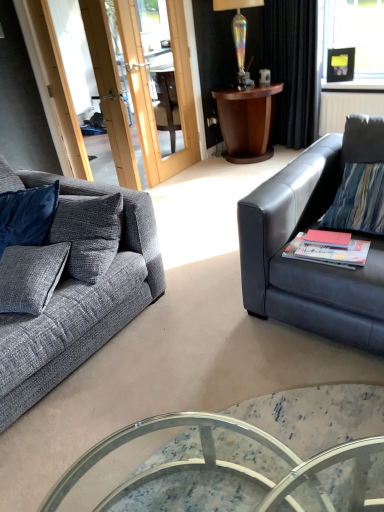
What do you see at coordinates (304, 230) in the screenshot? This screenshot has height=512, width=384. I see `matte black couch at right, positioned as the second studio couch in left-to-right order` at bounding box center [304, 230].

Where is `iridescent glass lamp at upper center`? The width and height of the screenshot is (384, 512). iridescent glass lamp at upper center is located at coordinates (239, 35).

At what (x,y) coordinates should I click in order to perform the action: click on marble glass coffee table at center. Please return your answer as a coordinate pair (x, y). Image resolution: width=384 pixels, height=512 pixels. Looking at the image, I should click on (238, 459).

What is the approximate width of black velvet curtain at upper right?

black velvet curtain at upper right is 26.96 centimeters wide.

What is the approximate height of dark wood side table at upper center?

dark wood side table at upper center is 26.50 inches in height.

Image resolution: width=384 pixels, height=512 pixels. Describe the element at coordinates (247, 121) in the screenshot. I see `dark wood side table at upper center` at that location.

Locate an element on the screen. The width and height of the screenshot is (384, 512). textured gray couch at left, which is counted as the 1th studio couch, starting from the left is located at coordinates (79, 290).

Would you consider marble glass coffee table at center to be distant from iridescent glass lamp at upper center?

Yes.

Is marble glass coffee table at center in front of or behind iridescent glass lamp at upper center in the image?

Clearly, marble glass coffee table at center is in front of iridescent glass lamp at upper center.

What's the angular difference between marble glass coffee table at center and iridescent glass lamp at upper center's facing directions?

There is a 2.73-degree angle between the facing directions of marble glass coffee table at center and iridescent glass lamp at upper center.

Which is in front, point (35, 391) or point (305, 238)?

The point (35, 391) is closer.

In terms of width, does textured gray couch at left, which is counted as the 1th studio couch, starting from the left, look wider or thinner when compared to matte red book at right, which ranks as the 1th book in left-to-right order?

textured gray couch at left, which is counted as the 1th studio couch, starting from the left, is wider than matte red book at right, which ranks as the 1th book in left-to-right order.

How different are the orientations of textured gray couch at left, which is counted as the 1th studio couch, starting from the left, and matte red book at right, acting as the second book starting from the right, in degrees?

textured gray couch at left, which is counted as the 1th studio couch, starting from the left, and matte red book at right, acting as the second book starting from the right, are facing 79.4 degrees away from each other.

From the image's perspective, which book is the 1st one above the textured gray couch at left, which is counted as the 1th studio couch, starting from the left? Please provide its 2D coordinates.

[(328, 252)]

Which is more to the right, matte white coffee cup at upper center or textured gray couch at left, which is counted as the 1th studio couch, starting from the left?

matte white coffee cup at upper center.

Which point is more forward, (261, 80) or (39, 326)?

The point (39, 326) is more forward.

From the image's perspective, which is above, matte white coffee cup at upper center or textured gray couch at left, placed as the 2th studio couch when sorted from right to left?

matte white coffee cup at upper center is shown above in the image.

Looking at this image, is matte white coffee cup at upper center positioned with its back to textured gray couch at left, which is counted as the 1th studio couch, starting from the left?

matte white coffee cup at upper center is not turned away from textured gray couch at left, which is counted as the 1th studio couch, starting from the left.

From the picture: From the image's perspective, is matte red book at right, acting as the second book starting from the right, located above matte black couch at right, positioned as the second studio couch in left-to-right order?

Actually, matte red book at right, acting as the second book starting from the right, appears below matte black couch at right, positioned as the second studio couch in left-to-right order, in the image.

Considering the relative sizes of matte red book at right, acting as the second book starting from the right, and matte black couch at right, positioned as the second studio couch in left-to-right order, in the image provided, is matte red book at right, acting as the second book starting from the right, taller than matte black couch at right, positioned as the second studio couch in left-to-right order,?

Incorrect, the height of matte red book at right, acting as the second book starting from the right, is not larger of that of matte black couch at right, positioned as the second studio couch in left-to-right order.

Is matte red book at right, which ranks as the 1th book in left-to-right order, wider than matte black couch at right, positioned as the 1th studio couch in right-to-left order?

Incorrect, the width of matte red book at right, which ranks as the 1th book in left-to-right order, does not surpass that of matte black couch at right, positioned as the 1th studio couch in right-to-left order.

Consider the image. Considering their positions, is matte red book at right, acting as the second book starting from the right, located in front of or behind matte black couch at right, positioned as the 1th studio couch in right-to-left order?

matte red book at right, acting as the second book starting from the right, is positioned farther from the viewer than matte black couch at right, positioned as the 1th studio couch in right-to-left order.

From a real-world perspective, which is physically above, iridescent glass lamp at upper center or black velvet curtain at upper right?

iridescent glass lamp at upper center is physically above.

Does iridescent glass lamp at upper center come in front of black velvet curtain at upper right?

Yes, iridescent glass lamp at upper center is closer to the camera.

How different are the orientations of iridescent glass lamp at upper center and black velvet curtain at upper right in degrees?

89.1 degrees separate the facing orientations of iridescent glass lamp at upper center and black velvet curtain at upper right.

Between iridescent glass lamp at upper center and black velvet curtain at upper right, which one has more height?

black velvet curtain at upper right.

Is matte black couch at right, positioned as the 1th studio couch in right-to-left order, aimed at marble glass coffee table at center?

Yes, matte black couch at right, positioned as the 1th studio couch in right-to-left order, faces towards marble glass coffee table at center.

Which of these two, matte black couch at right, positioned as the second studio couch in left-to-right order, or marble glass coffee table at center, is wider?

With larger width is matte black couch at right, positioned as the second studio couch in left-to-right order.

From a real-world perspective, who is located higher, matte black couch at right, positioned as the 1th studio couch in right-to-left order, or marble glass coffee table at center?

From a 3D spatial view, matte black couch at right, positioned as the 1th studio couch in right-to-left order, is above.

Choose the correct answer: Is dark wood side table at upper center inside matte red book at right, the first book in the right-to-left sequence, or outside it?

dark wood side table at upper center exists outside the volume of matte red book at right, the first book in the right-to-left sequence.

Which is more to the left, dark wood side table at upper center or matte red book at right, the first book in the right-to-left sequence?

dark wood side table at upper center is more to the left.

From the image's perspective, which one is positioned higher, dark wood side table at upper center or matte red book at right, the second book when ordered from left to right?

dark wood side table at upper center.

What are the coordinates of `lamp lying above the marble glass coffee table at center (from the image's perspective)` in the screenshot? It's located at [x=239, y=35].

In order to click on studio couch that is the 2nd one when counting forward from the matte red book at right, which ranks as the 1th book in left-to-right order in this screenshot , I will do `click(79, 290)`.

Which object lies nearer to the anchor point dark wood side table at upper center, textured gray couch at left, which is counted as the 1th studio couch, starting from the left, or matte black couch at right, positioned as the second studio couch in left-to-right order?

matte black couch at right, positioned as the second studio couch in left-to-right order.

Based on their spatial positions, is textured gray couch at left, placed as the 2th studio couch when sorted from right to left, or black velvet curtain at upper right further from matte red book at right, acting as the second book starting from the right?

The object further to matte red book at right, acting as the second book starting from the right, is black velvet curtain at upper right.

In the scene shown: From the image, which object appears to be farther from dark wood side table at upper center, matte red book at right, the first book in the right-to-left sequence, or matte black couch at right, positioned as the second studio couch in left-to-right order?

matte red book at right, the first book in the right-to-left sequence, lies further to dark wood side table at upper center than the other object.

Estimate the real-world distances between objects in this image. Which object is closer to matte red book at right, the first book in the right-to-left sequence, textured gray couch at left, placed as the 2th studio couch when sorted from right to left, or marble glass coffee table at center?

marble glass coffee table at center.

From the picture: Looking at the image, which one is located closer to dark wood side table at upper center, marble glass coffee table at center or matte red book at right, the first book in the right-to-left sequence?

matte red book at right, the first book in the right-to-left sequence, is positioned closer to the anchor dark wood side table at upper center.

Based on their spatial positions, is marble glass coffee table at center or matte black couch at right, positioned as the second studio couch in left-to-right order, further from iridescent glass lamp at upper center?

marble glass coffee table at center is positioned further to the anchor iridescent glass lamp at upper center.

Which object lies nearer to the anchor point matte red book at right, the first book in the right-to-left sequence, matte black couch at right, positioned as the second studio couch in left-to-right order, or marble glass coffee table at center?

The object closer to matte red book at right, the first book in the right-to-left sequence, is matte black couch at right, positioned as the second studio couch in left-to-right order.

Estimate the real-world distances between objects in this image. Which object is further from black velvet curtain at upper right, marble glass coffee table at center or textured gray couch at left, which is counted as the 1th studio couch, starting from the left?

marble glass coffee table at center is positioned further to the anchor black velvet curtain at upper right.

At what (x,y) coordinates should I click in order to perform the action: click on lamp between matte black couch at right, positioned as the 1th studio couch in right-to-left order, and dark wood side table at upper center, along the z-axis. Please return your answer as a coordinate pair (x, y). Looking at the image, I should click on (239, 35).

Locate an element on the screen. The width and height of the screenshot is (384, 512). lamp between matte red book at right, the first book in the right-to-left sequence, and matte white coffee cup at upper center, along the z-axis is located at coordinates (239, 35).

At what (x,y) coordinates should I click in order to perform the action: click on book between iridescent glass lamp at upper center and matte red book at right, which ranks as the 1th book in left-to-right order, vertically. Please return your answer as a coordinate pair (x, y). This screenshot has width=384, height=512. Looking at the image, I should click on (328, 238).

Where is `studio couch positioned between textured gray couch at left, which is counted as the 1th studio couch, starting from the left, and black velvet curtain at upper right from near to far`? studio couch positioned between textured gray couch at left, which is counted as the 1th studio couch, starting from the left, and black velvet curtain at upper right from near to far is located at coordinates (304, 230).